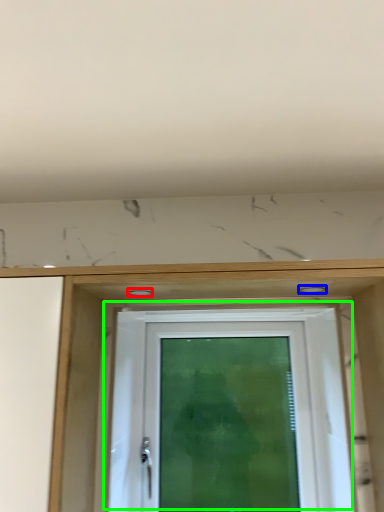
Question: Which is nearer to the hole (highlighted by a red box)? hole (highlighted by a blue box) or door (highlighted by a green box).

Choices:
 (A) hole
 (B) door

Answer: (A)